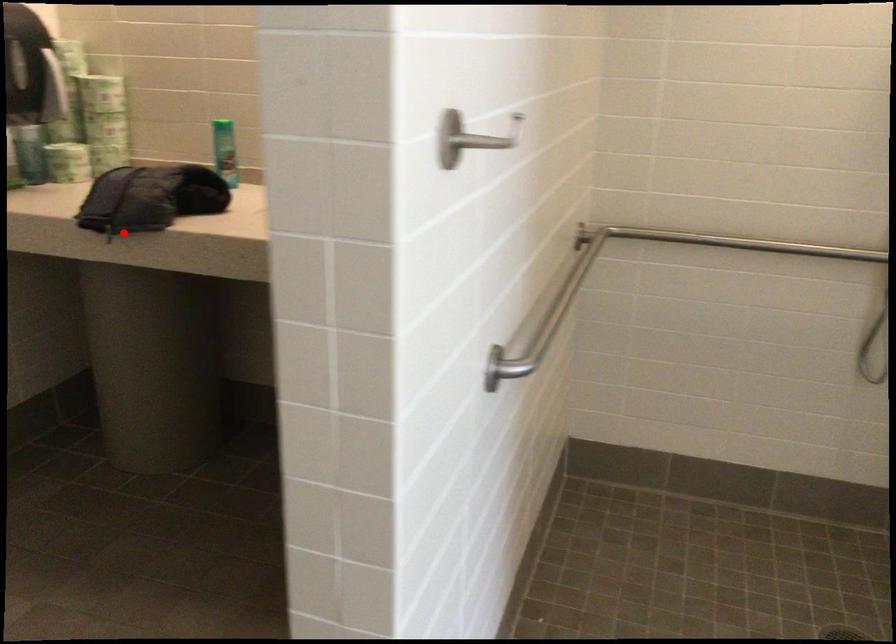
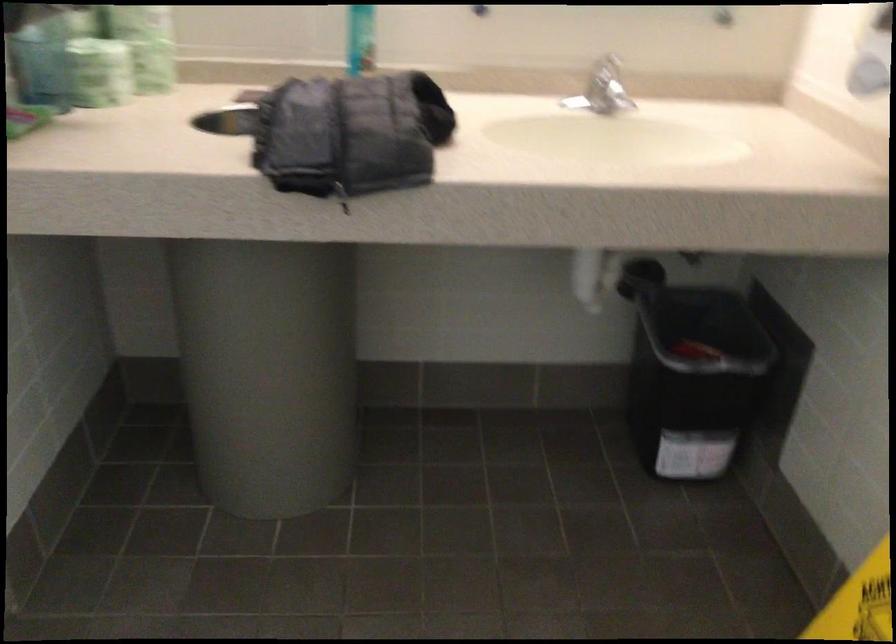
Question: A red point is marked in image1. In image2, is the corresponding 3D point closer to the camera or farther? Reply with the corresponding letter.

Choices:
 (A) The corresponding 3D point is closer.
 (B) The corresponding 3D point is farther.

Answer: (A)